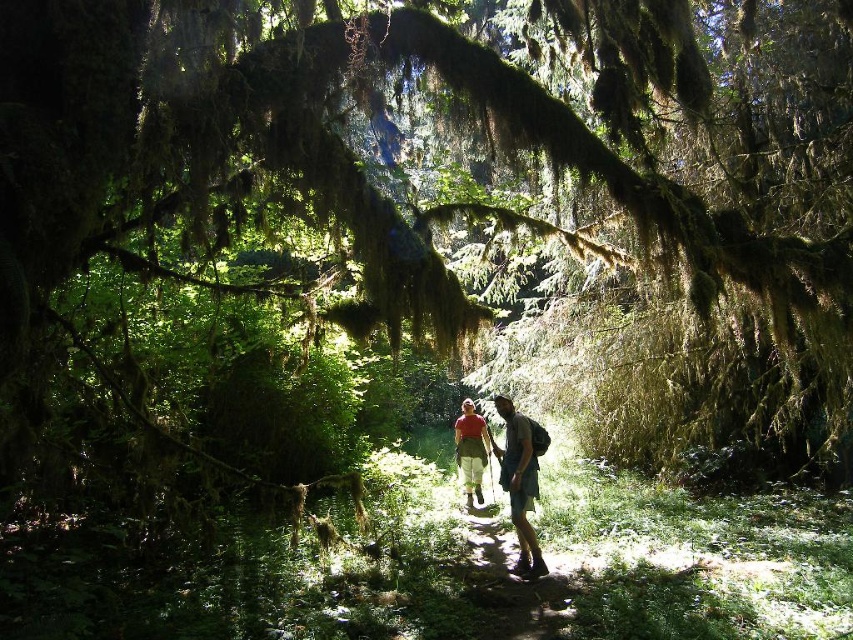
Can you confirm if matte green shorts at center is smaller than matte red shirt at center?

Correct, matte green shorts at center occupies less space than matte red shirt at center.

Which is below, matte green shorts at center or matte red shirt at center?

matte green shorts at center is lower down.

Is point (525, 472) farther from camera compared to point (474, 467)?

That is False.

Locate an element on the screen. The image size is (853, 640). matte green shorts at center is located at coordinates (521, 480).